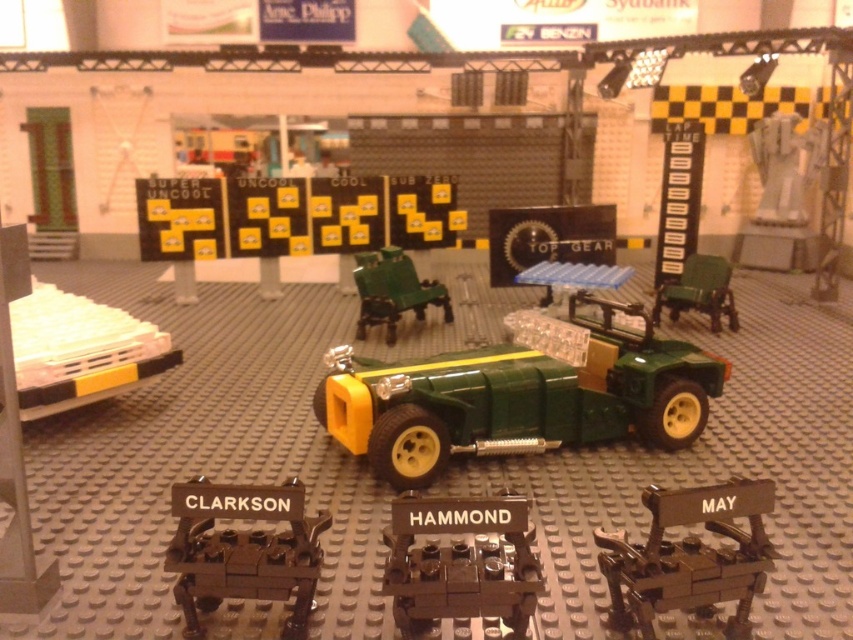
Consider the image. You are trying to place a dark brown wooden chair at center in your LEGO set, but there is already a green matte toy car at center. Based on their widths, can the chair fit next to the car without overlapping?

The green matte toy car at center might be wider than dark brown wooden chair at center, so there is a possibility that placing the chair next to the car could result in overlapping. Check their exact dimensions before deciding.

You are a guest visiting the LEGO Top Gear garage. You see the dark brown metallic engine at lower center and the green plastic chairs at center. Which object is located to the right of the other?

The dark brown metallic engine at lower center is positioned on the right side of green plastic chairs at center, so the engine is to the right of the chairs.

You are a child who wants to stack the white plastic toy at lower left on top of the green matte toy car at center. Is this possible without the stack falling over?

The green matte toy car at center is much taller than the white plastic toy at lower left. Since the car is taller, stacking the smaller toy on top might be unstable, but it could work if balanced carefully.